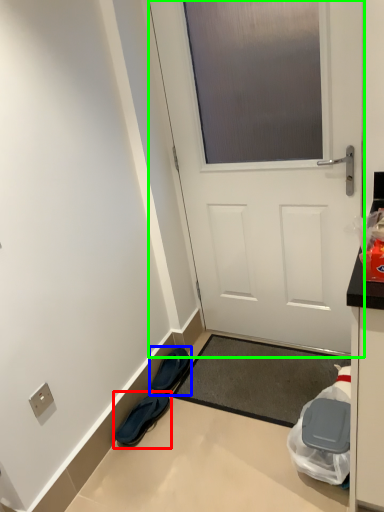
Question: Which is nearer to the footwear (highlighted by a red box)? footwear (highlighted by a blue box) or door (highlighted by a green box).

Choices:
 (A) footwear
 (B) door

Answer: (A)